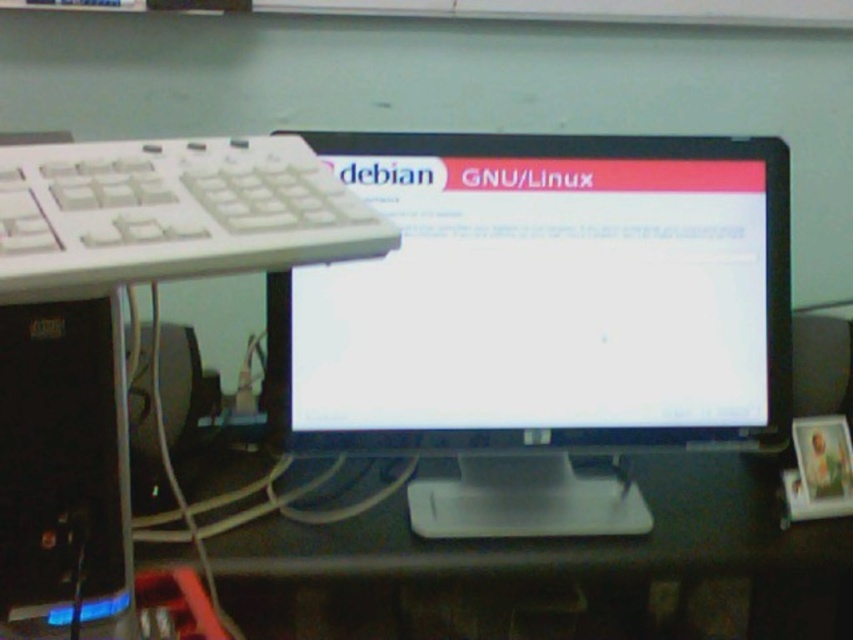
Question: Does white plastic keyboard at left have a larger size compared to black plastic desktop computer at left?

Choices:
 (A) yes
 (B) no

Answer: (A)

Question: Where is white plastic keyboard at left located in relation to black plastic desktop computer at left in the image?

Choices:
 (A) left
 (B) right

Answer: (B)

Question: Which point is closer to the camera taking this photo?

Choices:
 (A) (28, 484)
 (B) (51, 182)

Answer: (B)

Question: Which of the following is the farthest from the observer?

Choices:
 (A) (50, 420)
 (B) (235, 164)

Answer: (A)

Question: Which point is closer to the camera taking this photo?

Choices:
 (A) (93, 337)
 (B) (202, 275)

Answer: (B)

Question: Observing the image, what is the correct spatial positioning of white plastic keyboard at left in reference to black plastic desktop computer at left?

Choices:
 (A) below
 (B) above

Answer: (B)